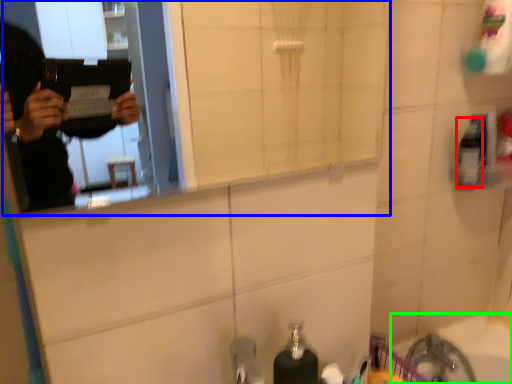
Question: Considering the real-world distances, which object is farthest from mouthwash (highlighted by a red box)? mirror (highlighted by a blue box) or bath (highlighted by a green box)?

Choices:
 (A) mirror
 (B) bath

Answer: (A)